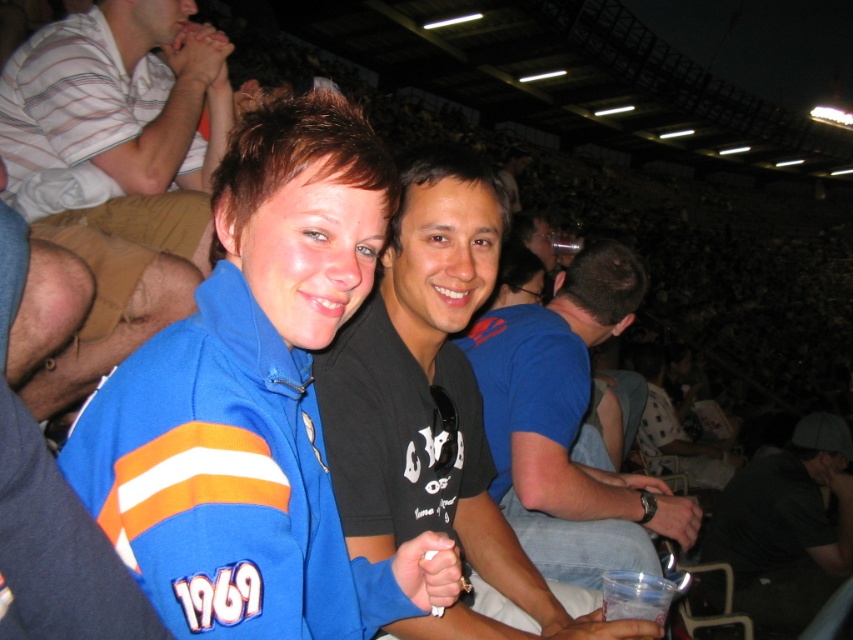
Question: Which point is closer to the camera?

Choices:
 (A) (149, 49)
 (B) (468, 445)
 (C) (793, 589)

Answer: (B)

Question: Does blue fleece jacket at center appear on the left side of striped cotton shirt at upper left?

Choices:
 (A) no
 (B) yes

Answer: (A)

Question: Can you confirm if black matte shirt at center is positioned below dark gray t-shirt at center?

Choices:
 (A) yes
 (B) no

Answer: (B)

Question: Is black matte shirt at center positioned at the back of black cotton t-shirt at center?

Choices:
 (A) yes
 (B) no

Answer: (B)

Question: Which of the following is the farthest from the observer?

Choices:
 (A) (625, 492)
 (B) (392, 490)
 (C) (207, 260)

Answer: (C)

Question: Among these points, which one is nearest to the camera?

Choices:
 (A) tap(851, 508)
 (B) tap(74, 237)
 (C) tap(189, 520)
 (D) tap(575, 310)

Answer: (C)